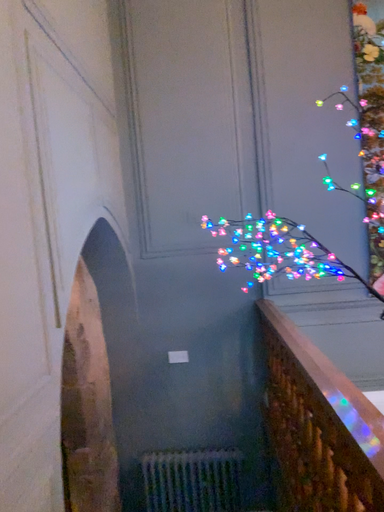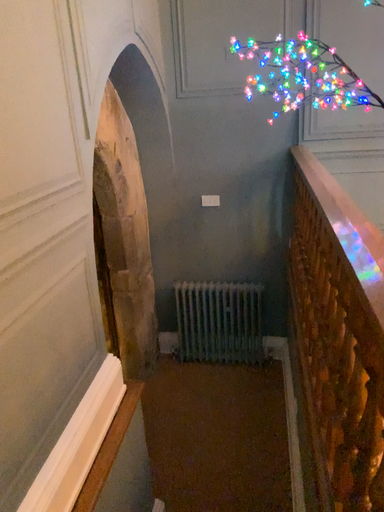
Question: Which way did the camera rotate in the video?

Choices:
 (A) rotated downward
 (B) rotated upward

Answer: (A)